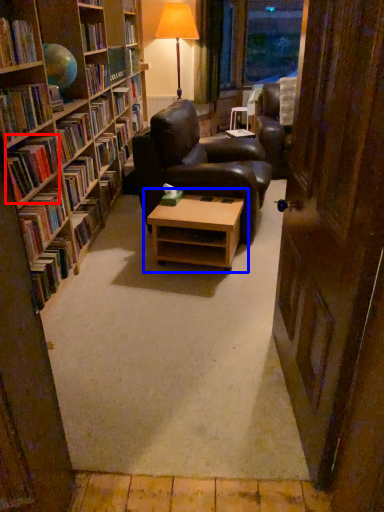
Question: Which of the following is the closest to the observer, book (highlighted by a red box) or table (highlighted by a blue box)?

Choices:
 (A) book
 (B) table

Answer: (A)